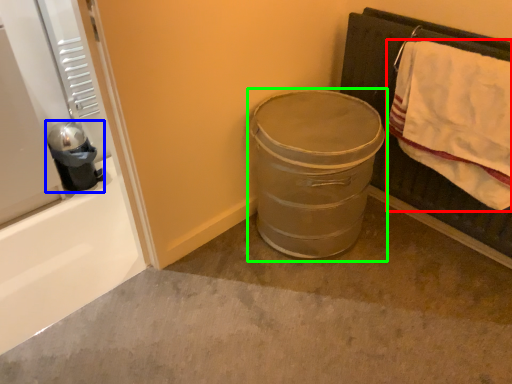
Question: Based on their relative distances, which object is farther from bath towel (highlighted by a red box)? Choose from appliance (highlighted by a blue box) and trash bin/can (highlighted by a green box).

Choices:
 (A) appliance
 (B) trash bin/can

Answer: (A)